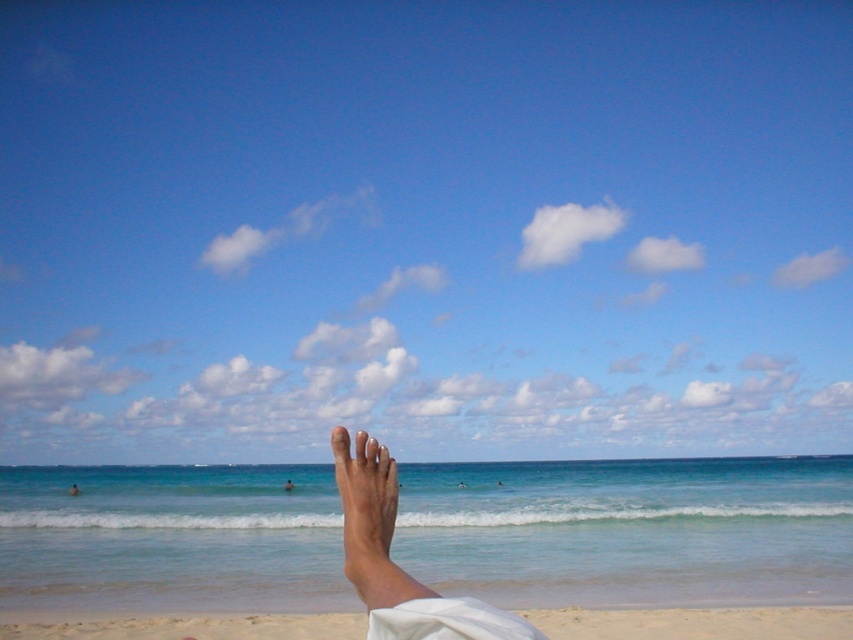
This screenshot has height=640, width=853. Describe the element at coordinates (695, 621) in the screenshot. I see `white sandy beach at lower center` at that location.

Does white sandy beach at lower center appear over white matte foot at center?

No, white sandy beach at lower center is not above white matte foot at center.

The width and height of the screenshot is (853, 640). What are the coordinates of `white sandy beach at lower center` in the screenshot? It's located at click(x=695, y=621).